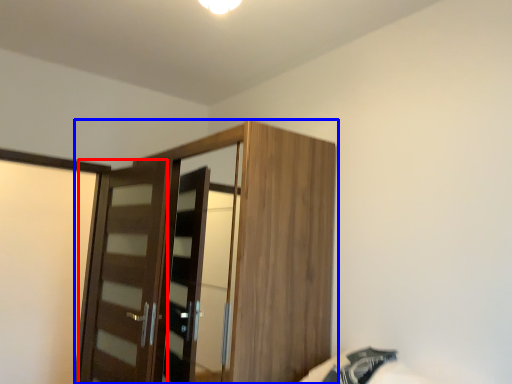
Question: Among these objects, which one is farthest to the camera, door (highlighted by a red box) or cupboard (highlighted by a blue box)?

Choices:
 (A) door
 (B) cupboard

Answer: (A)